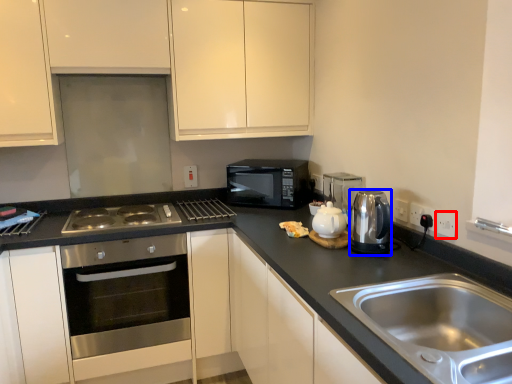
Question: Among these objects, which one is farthest to the camera, electric outlet (highlighted by a red box) or appliance (highlighted by a blue box)?

Choices:
 (A) electric outlet
 (B) appliance

Answer: (A)